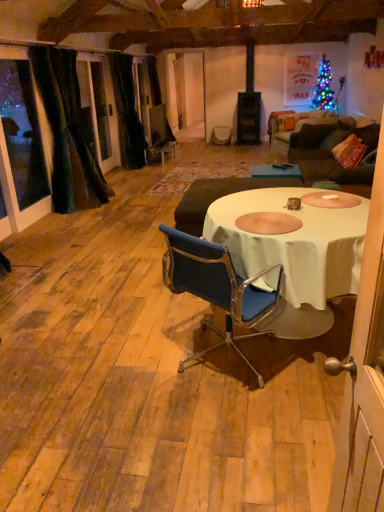
In order to click on white cloth table at center in this screenshot , I will do `click(274, 328)`.

Locate an element on the screen. This screenshot has height=512, width=384. black velvet curtain at left, which is counted as the first curtain, starting from the back is located at coordinates (127, 112).

The image size is (384, 512). In order to click on white fabric table at center in this screenshot , I will do `click(276, 170)`.

Measure the distance between white fabric table at center and camera.

14.35 feet.

Locate an element on the screen. The image size is (384, 512). blue fabric chair at center is located at coordinates (217, 287).

The height and width of the screenshot is (512, 384). Find the location of `armchair that appears above the white cloth table at center (from the image's perspective)`. armchair that appears above the white cloth table at center (from the image's perspective) is located at coordinates (221, 135).

What's the angular difference between white cloth table at center and velvet dark brown armchair at center's facing directions?

The facing directions of white cloth table at center and velvet dark brown armchair at center are 88 degrees apart.

Which is nearer, (166,269) or (212,139)?

Point (166,269).

Can you tell me how much white cloth table at center and velvet dark green curtain at left, the 1th curtain from the front, differ in facing direction?

179 degrees separate the facing orientations of white cloth table at center and velvet dark green curtain at left, the 1th curtain from the front.

Considering the positions of objects white cloth table at center and velvet dark green curtain at left, acting as the second curtain starting from the back, in the image provided, who is in front, white cloth table at center or velvet dark green curtain at left, acting as the second curtain starting from the back,?

white cloth table at center is more forward.

Is white cloth table at center positioned with its back to velvet dark green curtain at left, acting as the second curtain starting from the back?

No, white cloth table at center is not facing the opposite direction of velvet dark green curtain at left, acting as the second curtain starting from the back.

Is white cloth table at center positioned beyond the bounds of black velvet curtain at left, the 2th curtain viewed from the front?

Yes.

Measure the distance from white cloth table at center to black velvet curtain at left, which is counted as the first curtain, starting from the back.

They are 4.33 meters apart.

From the image's perspective, which one is positioned lower, white cloth table at center or black velvet curtain at left, the 2th curtain viewed from the front?

white cloth table at center appears lower in the image.

Consider the image. Is white cloth table at center far away from black velvet curtain at left, which is counted as the first curtain, starting from the back?

Absolutely, white cloth table at center is distant from black velvet curtain at left, which is counted as the first curtain, starting from the back.

From the picture: In terms of width, does blue fabric chair at center look wider or thinner when compared to black velvet curtain at left, which is counted as the first curtain, starting from the back?

Considering their sizes, blue fabric chair at center looks broader than black velvet curtain at left, which is counted as the first curtain, starting from the back.

Which of these two, blue fabric chair at center or black velvet curtain at left, which is counted as the first curtain, starting from the back, stands shorter?

Standing shorter between the two is blue fabric chair at center.

Does blue fabric chair at center touch black velvet curtain at left, which is counted as the first curtain, starting from the back?

blue fabric chair at center and black velvet curtain at left, which is counted as the first curtain, starting from the back, are clearly separated.

From a real-world perspective, is blue fabric chair at center physically below black velvet curtain at left, which is counted as the first curtain, starting from the back?

Yes, from a real-world perspective, blue fabric chair at center is beneath black velvet curtain at left, which is counted as the first curtain, starting from the back.

Looking at this image, is dark brown fabric couch at right taller than black velvet curtain at left, the 2th curtain viewed from the front?

No, dark brown fabric couch at right is not taller than black velvet curtain at left, the 2th curtain viewed from the front.

Where is `couch below the black velvet curtain at left, the 2th curtain viewed from the front (from a real-world perspective)`? This screenshot has height=512, width=384. couch below the black velvet curtain at left, the 2th curtain viewed from the front (from a real-world perspective) is located at coordinates (303, 131).

Does point (343, 125) appear closer or farther from the camera than point (130, 126)?

Clearly, point (343, 125) is closer to the camera than point (130, 126).

Does dark brown fabric couch at right have a larger size compared to black velvet curtain at left, which is counted as the first curtain, starting from the back?

No.

Is transparent glass door at left taller or shorter than white fabric table at center?

Clearly, transparent glass door at left is taller compared to white fabric table at center.

Considering the positions of point (19, 169) and point (274, 170), is point (19, 169) closer or farther from the camera than point (274, 170)?

Point (19, 169) is closer to the camera than point (274, 170).

Considering the sizes of objects transparent glass door at left and white fabric table at center in the image provided, who is smaller, transparent glass door at left or white fabric table at center?

white fabric table at center is smaller.

Considering the positions of objects transparent glass door at left and white fabric table at center in the image provided, who is behind, transparent glass door at left or white fabric table at center?

white fabric table at center is more distant.

Would you consider white fabric table at center to be distant from velvet dark brown armchair at center?

Yes.

You are a GUI agent. You are given a task and a screenshot of the screen. Output one action in this format:
    pyautogui.click(x=<x>, y=<y>)
    Task: Click on the table in front of the velvet dark brown armchair at center
    
    Given the screenshot: What is the action you would take?
    pyautogui.click(x=276, y=170)

From a real-world perspective, is white fabric table at center positioned above or below velvet dark brown armchair at center?

white fabric table at center is above velvet dark brown armchair at center.

Looking at their sizes, would you say white fabric table at center is wider or thinner than velvet dark brown armchair at center?

In the image, white fabric table at center appears to be wider than velvet dark brown armchair at center.

I want to click on armchair lying above the white cloth table at center (from the image's perspective), so click(x=221, y=135).

The height and width of the screenshot is (512, 384). Find the location of `dinner party that is in front of the velvet dark green curtain at left, the 1th curtain from the front`. dinner party that is in front of the velvet dark green curtain at left, the 1th curtain from the front is located at coordinates (274, 328).

Estimate the real-world distances between objects in this image. Which object is further from dark brown fabric couch at right, white cloth table at center or blue fabric chair at center?

blue fabric chair at center is positioned further to the anchor dark brown fabric couch at right.

Looking at the image, which one is located further to velvet dark brown armchair at center, transparent glass door at left or black velvet curtain at left, the 2th curtain viewed from the front?

The object further to velvet dark brown armchair at center is transparent glass door at left.

Which object lies further to the anchor point black velvet curtain at left, which is counted as the first curtain, starting from the back, velvet dark brown armchair at center or white fabric table at center?

white fabric table at center is further to black velvet curtain at left, which is counted as the first curtain, starting from the back.

From the image, which object appears to be farther from black velvet curtain at left, the 2th curtain viewed from the front, dark brown fabric couch at right or white cloth table at center?

Among the two, white cloth table at center is located further to black velvet curtain at left, the 2th curtain viewed from the front.

Looking at the image, which one is located closer to velvet dark brown armchair at center, white cloth table at center or dark brown fabric couch at right?

dark brown fabric couch at right lies closer to velvet dark brown armchair at center than the other object.

From the image, which object appears to be farther from black velvet curtain at left, the 2th curtain viewed from the front, transparent glass door at left or white fabric table at center?

The object further to black velvet curtain at left, the 2th curtain viewed from the front, is white fabric table at center.

From the image, which object appears to be farther from velvet dark brown armchair at center, white cloth table at center or blue fabric chair at center?

blue fabric chair at center is further to velvet dark brown armchair at center.

Estimate the real-world distances between objects in this image. Which object is further from velvet dark brown armchair at center, transparent glass door at left or dark brown fabric couch at right?

The object further to velvet dark brown armchair at center is transparent glass door at left.

Identify the location of table between blue fabric chair at center and black velvet curtain at left, the 2th curtain viewed from the front, along the z-axis. (276, 170).

Where is `curtain situated between velvet dark green curtain at left, the 1th curtain from the front, and dark brown fabric couch at right from left to right`? This screenshot has width=384, height=512. curtain situated between velvet dark green curtain at left, the 1th curtain from the front, and dark brown fabric couch at right from left to right is located at coordinates (127, 112).

At what (x,y) coordinates should I click in order to perform the action: click on dinner party between blue fabric chair at center and velvet dark brown armchair at center in the front-back direction. Please return your answer as a coordinate pair (x, y). Image resolution: width=384 pixels, height=512 pixels. Looking at the image, I should click on (274, 328).

Locate an element on the screen. This screenshot has width=384, height=512. window screen between white cloth table at center and velvet dark brown armchair at center in the front-back direction is located at coordinates coord(22,133).